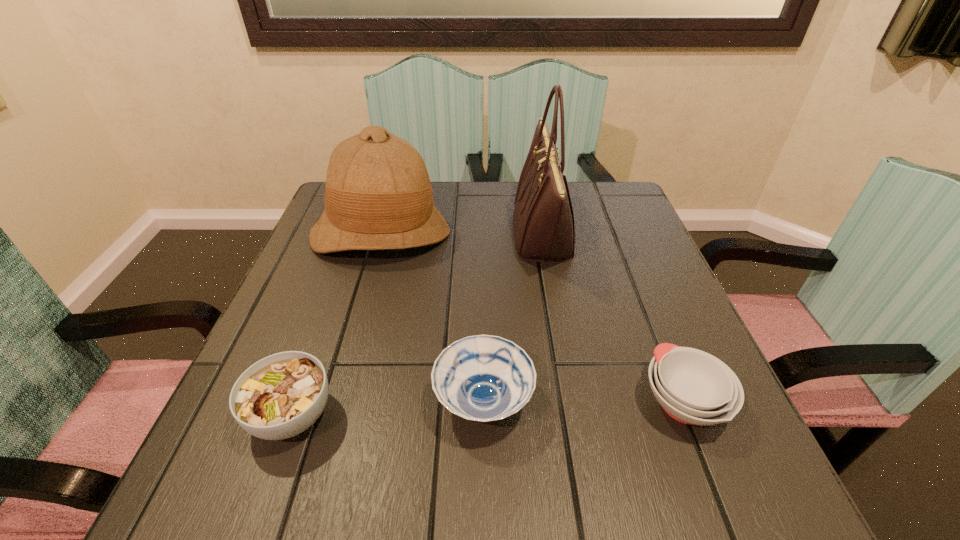
Image resolution: width=960 pixels, height=540 pixels. Find the location of `vacant space that's between the tallest object and the rightmost soup bowl`. vacant space that's between the tallest object and the rightmost soup bowl is located at coordinates (613, 318).

Find the location of a particular element. unoccupied position between the leftmost soup bowl and the hat is located at coordinates (337, 325).

You are a GUI agent. You are given a task and a screenshot of the screen. Output one action in this format:
    pyautogui.click(x=<x>, y=<y>)
    Task: Click on the empty space that is in between the handbag and the leftmost soup bowl
    Image resolution: width=960 pixels, height=540 pixels.
    Given the screenshot: What is the action you would take?
    pyautogui.click(x=418, y=325)

I want to click on vacant area that lies between the leftmost soup bowl and the fourth shortest object, so click(x=337, y=325).

This screenshot has height=540, width=960. I want to click on vacant region between the rightmost object and the second tallest object, so click(x=532, y=318).

Locate an element on the screen. free area in between the leftmost soup bowl and the hat is located at coordinates (337, 325).

Locate which object ranks second in proximity to the handbag. Please provide its 2D coordinates. Your answer should be formatted as a tuple, i.e. [(x, y)], where the tuple contains the x and y coordinates of a point satisfying the conditions above.

[(483, 378)]

Identify the location of object that is the closest to the leftmost soup bowl. Image resolution: width=960 pixels, height=540 pixels. (483, 378).

Select which soup bowl appears as the closest to the tallest object. Please provide its 2D coordinates. Your answer should be formatted as a tuple, i.e. [(x, y)], where the tuple contains the x and y coordinates of a point satisfying the conditions above.

[(483, 378)]

Choose which soup bowl is the nearest neighbor to the rightmost object. Please provide its 2D coordinates. Your answer should be formatted as a tuple, i.e. [(x, y)], where the tuple contains the x and y coordinates of a point satisfying the conditions above.

[(483, 378)]